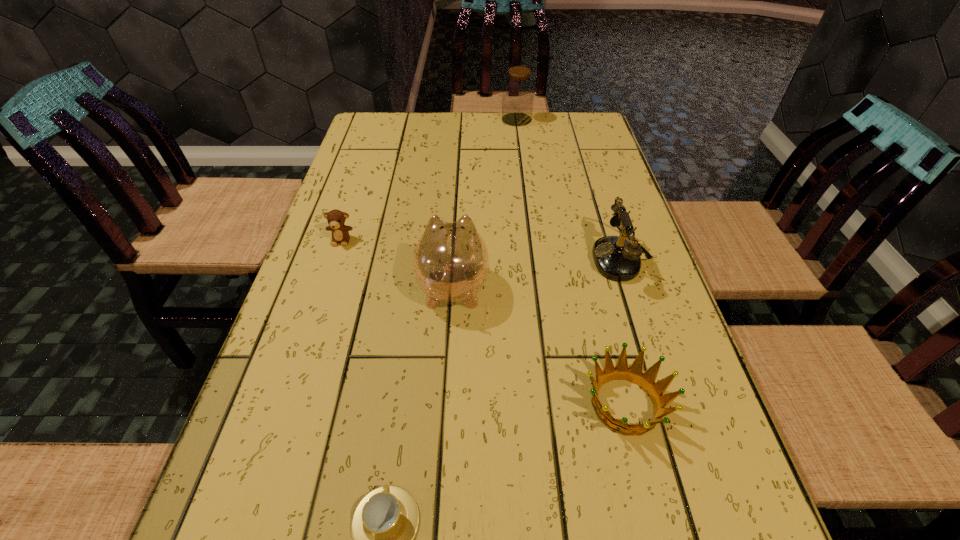
The width and height of the screenshot is (960, 540). Find the location of `object that is the fourth closest one to the leftmost object`. object that is the fourth closest one to the leftmost object is located at coordinates (634, 374).

What are the coordinates of `object that stands as the third closest to the teddy bear` in the screenshot? It's located at (615, 257).

Where is `vacant space that satisfies the following two spatial constraints: 1. on the front side of the crown; 2. on the right side of the third object from right to left`? Image resolution: width=960 pixels, height=540 pixels. vacant space that satisfies the following two spatial constraints: 1. on the front side of the crown; 2. on the right side of the third object from right to left is located at coordinates pyautogui.click(x=552, y=404).